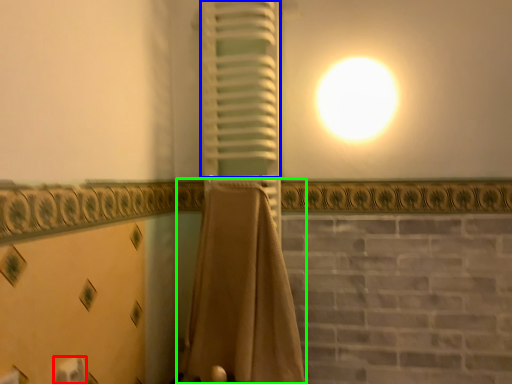
Question: Which object is the farthest from toilet paper (highlighted by a red box)? Choose among these: curtain (highlighted by a blue box) or curtain (highlighted by a green box).

Choices:
 (A) curtain
 (B) curtain

Answer: (A)